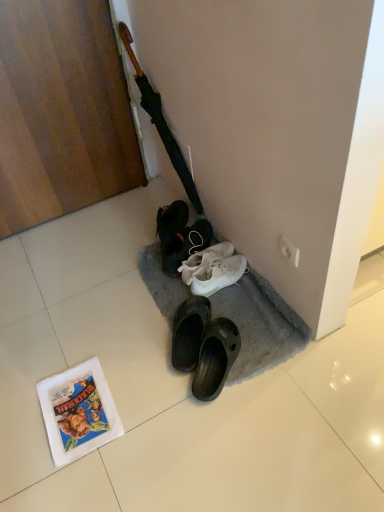
Question: From the image's perspective, would you say white plastic power outlet at upper right is positioned over white paper comic book at lower left?

Choices:
 (A) no
 (B) yes

Answer: (B)

Question: Does white plastic power outlet at upper right have a lesser width compared to white paper comic book at lower left?

Choices:
 (A) no
 (B) yes

Answer: (B)

Question: Does white plastic power outlet at upper right have a smaller size compared to white paper comic book at lower left?

Choices:
 (A) yes
 (B) no

Answer: (A)

Question: Could you tell me if white plastic power outlet at upper right is turned towards white paper comic book at lower left?

Choices:
 (A) yes
 (B) no

Answer: (A)

Question: Are white plastic power outlet at upper right and white paper comic book at lower left far apart?

Choices:
 (A) yes
 (B) no

Answer: (B)

Question: Is white plastic power outlet at upper right wider than white paper comic book at lower left?

Choices:
 (A) no
 (B) yes

Answer: (A)

Question: Is white plastic power outlet at upper right at the back of white paper comic book at lower left?

Choices:
 (A) no
 (B) yes

Answer: (A)

Question: Are white paper comic book at lower left and white plastic power outlet at upper right far apart?

Choices:
 (A) no
 (B) yes

Answer: (A)

Question: From a real-world perspective, is white paper comic book at lower left on white plastic power outlet at upper right?

Choices:
 (A) no
 (B) yes

Answer: (A)

Question: Is white paper comic book at lower left positioned beyond the bounds of white plastic power outlet at upper right?

Choices:
 (A) no
 (B) yes

Answer: (B)

Question: From a real-world perspective, is white paper comic book at lower left below white plastic power outlet at upper right?

Choices:
 (A) no
 (B) yes

Answer: (B)

Question: Does white paper comic book at lower left have a greater width compared to white plastic power outlet at upper right?

Choices:
 (A) yes
 (B) no

Answer: (A)

Question: Considering the positions of point (61, 460) and point (294, 265), is point (61, 460) closer or farther from the camera than point (294, 265)?

Choices:
 (A) farther
 (B) closer

Answer: (B)